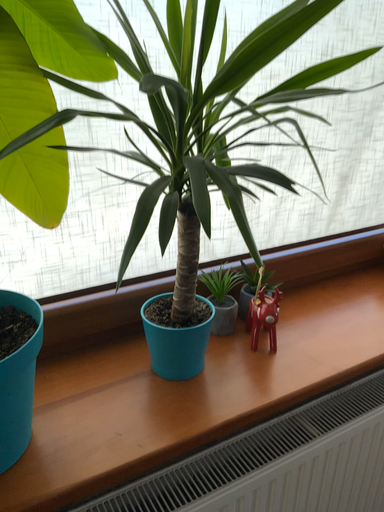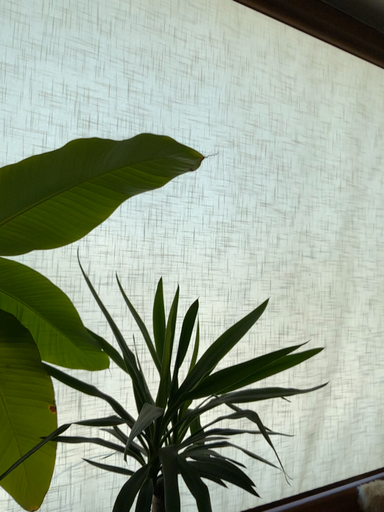
Question: How did the camera likely rotate when shooting the video?

Choices:
 (A) rotated downward
 (B) rotated upward

Answer: (B)